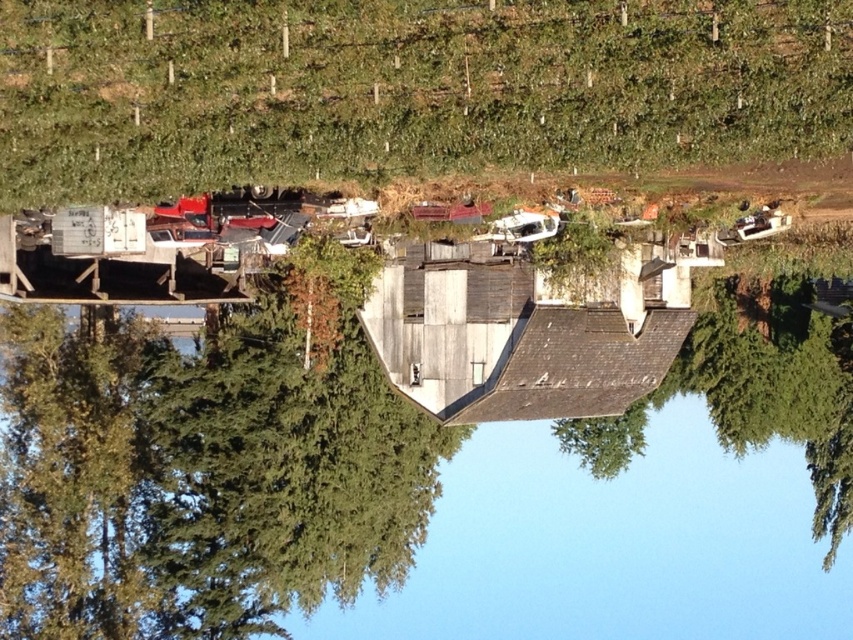
Question: Can you confirm if green leafy hillside at upper center is positioned to the left of green matte tree at center?

Choices:
 (A) no
 (B) yes

Answer: (B)

Question: Estimate the real-world distances between objects in this image. Which object is farther from the green matte tree at center?

Choices:
 (A) green leafy hillside at upper center
 (B) weathered wood hut at center

Answer: (A)

Question: Can you confirm if green leafy hillside at upper center is thinner than weathered wood hut at center?

Choices:
 (A) yes
 (B) no

Answer: (B)

Question: Which point is closer to the camera taking this photo?

Choices:
 (A) [x=109, y=173]
 (B) [x=566, y=300]

Answer: (A)

Question: Which object appears closest to the camera in this image?

Choices:
 (A) green leafy hillside at upper center
 (B) green matte tree at center
 (C) weathered wood hut at center

Answer: (A)

Question: Can you confirm if weathered wood hut at center is bigger than green matte tree at center?

Choices:
 (A) no
 (B) yes

Answer: (B)